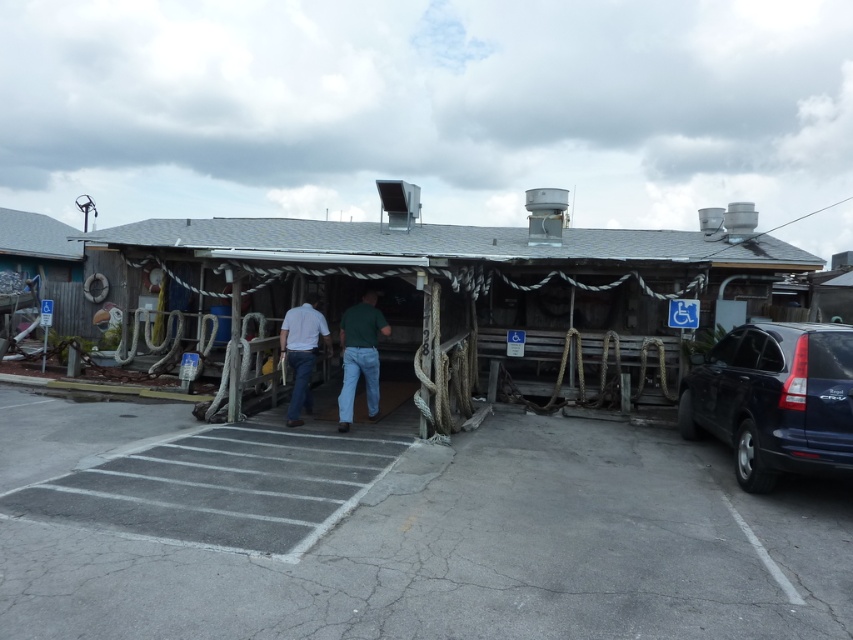
Can you confirm if gray asphalt parking lot at lower center is bigger than shiny blue suv at right?

No, gray asphalt parking lot at lower center is not bigger than shiny blue suv at right.

Who is positioned more to the left, gray asphalt parking lot at lower center or shiny blue suv at right?

Positioned to the left is gray asphalt parking lot at lower center.

You are a GUI agent. You are given a task and a screenshot of the screen. Output one action in this format:
    pyautogui.click(x=<x>, y=<y>)
    Task: Click on the gray asphalt parking lot at lower center
    Image resolution: width=853 pixels, height=640 pixels.
    Given the screenshot: What is the action you would take?
    pyautogui.click(x=399, y=531)

Which of these two, gray asphalt parking lot at lower center or green cotton shirt at center, stands taller?

With more height is green cotton shirt at center.

Image resolution: width=853 pixels, height=640 pixels. What do you see at coordinates (399, 531) in the screenshot? I see `gray asphalt parking lot at lower center` at bounding box center [399, 531].

Where is `gray asphalt parking lot at lower center`? gray asphalt parking lot at lower center is located at coordinates (399, 531).

I want to click on gray asphalt parking lot at lower center, so click(x=399, y=531).

Where is `shiny blue suv at right`? shiny blue suv at right is located at coordinates (775, 400).

Can you confirm if shiny blue suv at right is shorter than wooden hut at left?

Yes.

Between point (809, 406) and point (61, 240), which one is positioned behind?

Positioned behind is point (61, 240).

Where is `shiny blue suv at right`? This screenshot has width=853, height=640. shiny blue suv at right is located at coordinates (775, 400).